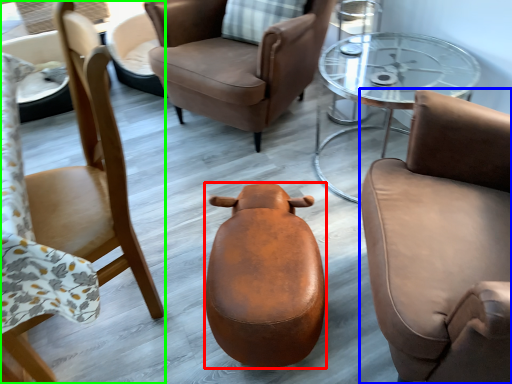
Question: Which object is the closest to the stool (highlighted by a red box)? Choose among these: chair (highlighted by a blue box) or chair (highlighted by a green box).

Choices:
 (A) chair
 (B) chair

Answer: (A)